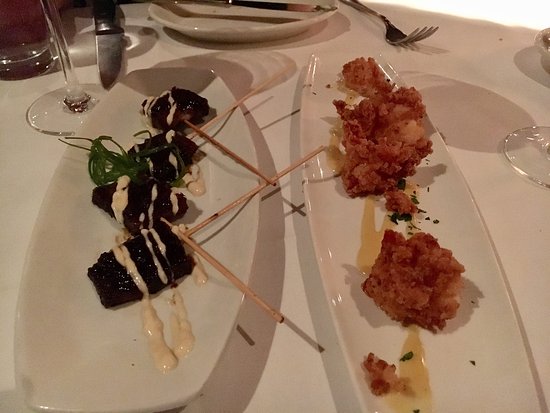
Locate an element on the screen. fork is located at coordinates (393, 32).